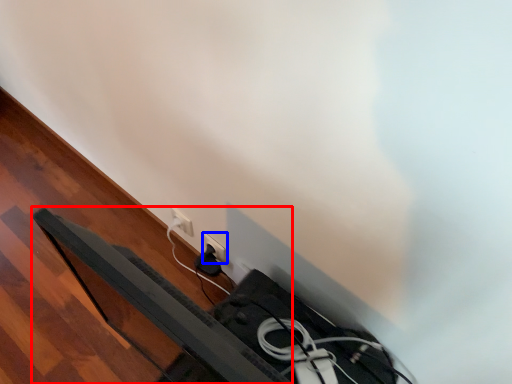
Question: Among these objects, which one is nearest to the camera, bed frame (highlighted by a red box) or power plugs and sockets (highlighted by a blue box)?

Choices:
 (A) bed frame
 (B) power plugs and sockets

Answer: (A)